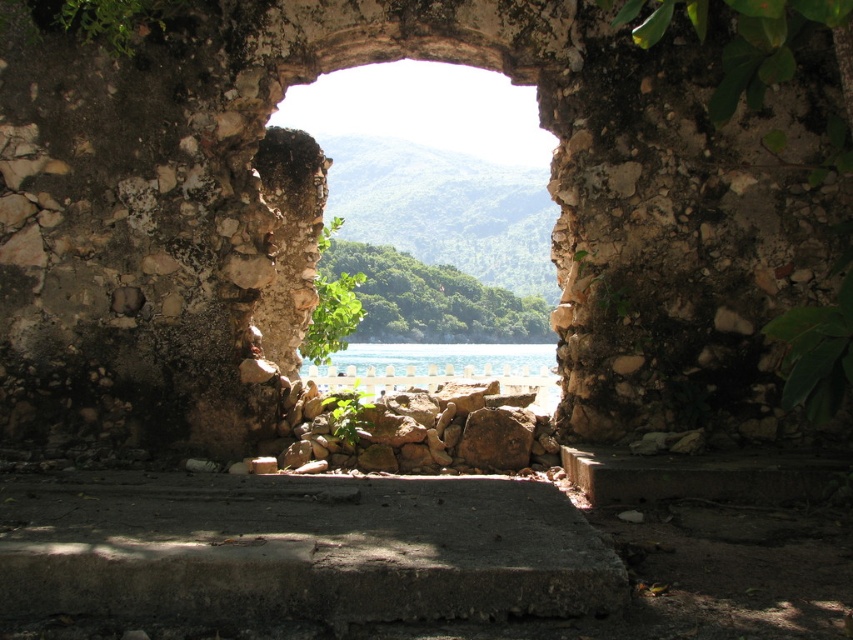
Between natural stone window at center and clear blue water at center, which one appears on the left side from the viewer's perspective?

clear blue water at center

Is natural stone window at center below clear blue water at center?

Actually, natural stone window at center is above clear blue water at center.

The image size is (853, 640). I want to click on natural stone window at center, so click(436, 164).

Find the location of a particular element. Image resolution: width=853 pixels, height=640 pixels. natural stone window at center is located at coordinates (436, 164).